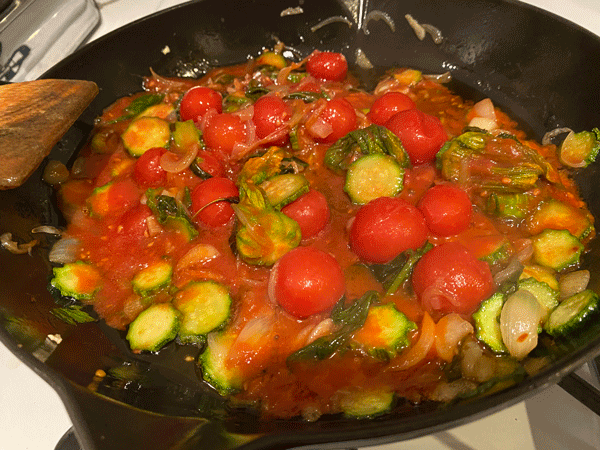
This screenshot has width=600, height=450. Find the location of `wooden spatula`. wooden spatula is located at coordinates (29, 103).